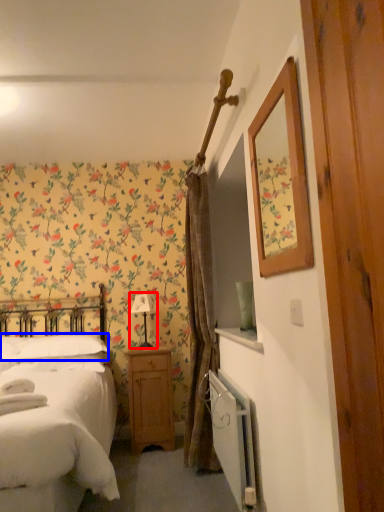
Question: Which point is further to the camera, table lamp (highlighted by a red box) or pillow (highlighted by a blue box)?

Choices:
 (A) table lamp
 (B) pillow

Answer: (A)